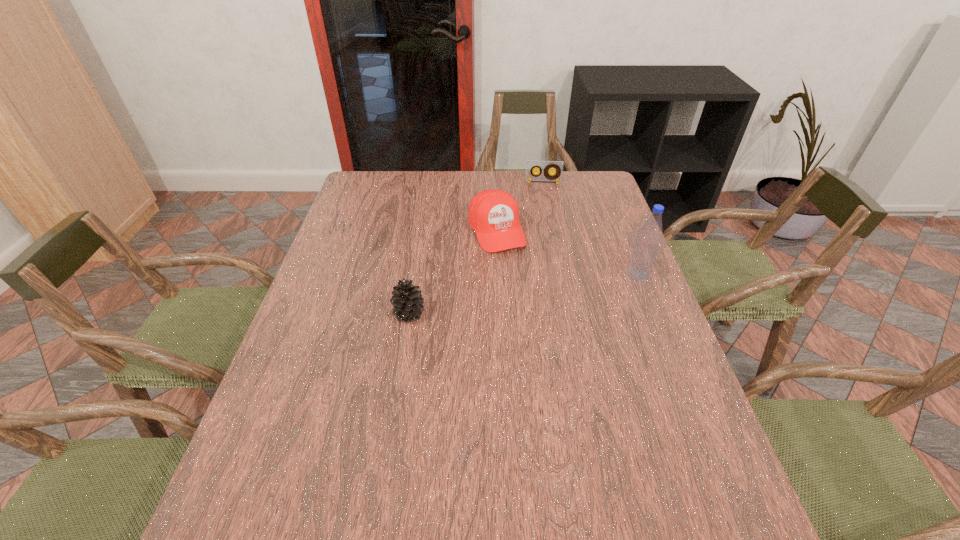
Where is `blank area located 0.250m on the front panel of the second object from left to right`? The image size is (960, 540). blank area located 0.250m on the front panel of the second object from left to right is located at coordinates (537, 313).

Where is `vacant region located on the front panel of the second object from left to right`? vacant region located on the front panel of the second object from left to right is located at coordinates (545, 329).

The height and width of the screenshot is (540, 960). Find the location of `vacant space located 0.290m on the front panel of the second object from left to right`. vacant space located 0.290m on the front panel of the second object from left to right is located at coordinates (542, 323).

Where is `vacant area situated at the front of the shortest object with visible reels`? This screenshot has height=540, width=960. vacant area situated at the front of the shortest object with visible reels is located at coordinates (543, 207).

Locate an element on the screen. This screenshot has height=540, width=960. free point located at the front of the shortest object with visible reels is located at coordinates (544, 236).

You are a GUI agent. You are given a task and a screenshot of the screen. Output one action in this format:
    pyautogui.click(x=<x>, y=<y>)
    Task: Click on the vacant space located 0.130m at the front of the shortest object with visible reels
    Image resolution: width=960 pixels, height=540 pixels.
    Given the screenshot: What is the action you would take?
    pyautogui.click(x=542, y=204)

Image resolution: width=960 pixels, height=540 pixels. In order to click on object present at the far edge in this screenshot , I will do pyautogui.click(x=531, y=165).

Identify the location of water bottle at the right edge. The height and width of the screenshot is (540, 960). (645, 251).

Locate an element on the screen. The image size is (960, 540). videotape at the right edge is located at coordinates (531, 165).

Locate an element on the screen. The height and width of the screenshot is (540, 960). object that is at the far right corner is located at coordinates click(531, 165).